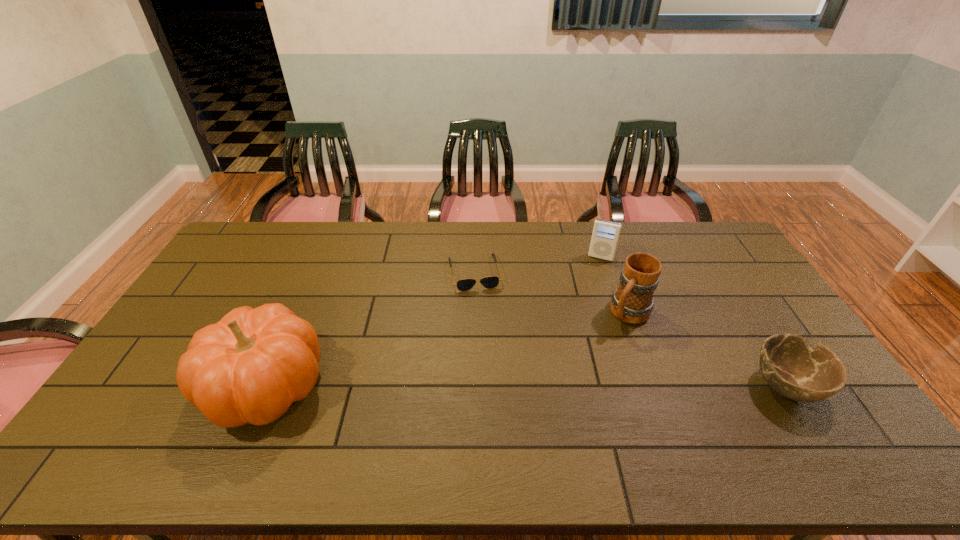
This screenshot has width=960, height=540. I want to click on object that is the third closest to the sunglasses, so click(249, 367).

This screenshot has width=960, height=540. Find the location of `free space that satisfies the following two spatial constraints: 1. on the back side of the leftmost object; 2. on the left side of the iPod`. free space that satisfies the following two spatial constraints: 1. on the back side of the leftmost object; 2. on the left side of the iPod is located at coordinates [322, 258].

Where is `vacant region that satisfies the following two spatial constraints: 1. on the front side of the leftmost object; 2. on the right side of the bowl`? The image size is (960, 540). vacant region that satisfies the following two spatial constraints: 1. on the front side of the leftmost object; 2. on the right side of the bowl is located at coordinates (266, 386).

The height and width of the screenshot is (540, 960). I want to click on vacant space that satisfies the following two spatial constraints: 1. on the back side of the tallest object; 2. on the right side of the second object from left to right, so click(x=315, y=273).